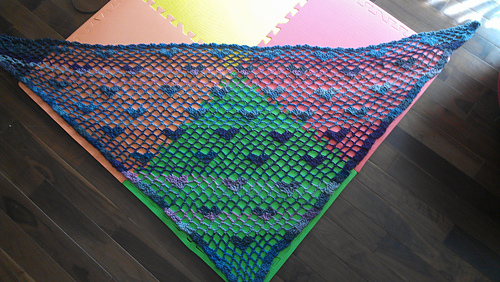
Where is `yellow tile`? The height and width of the screenshot is (282, 500). yellow tile is located at coordinates (225, 26).